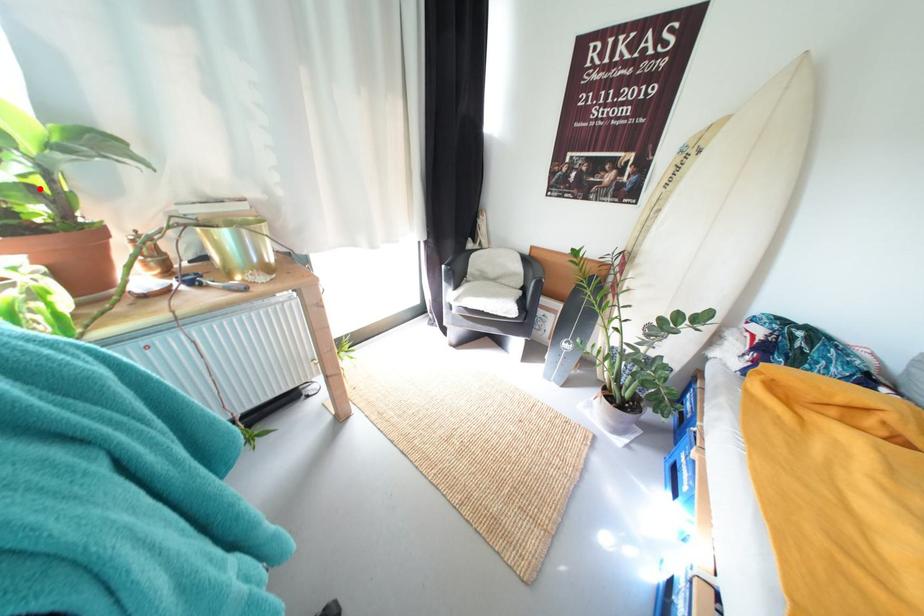
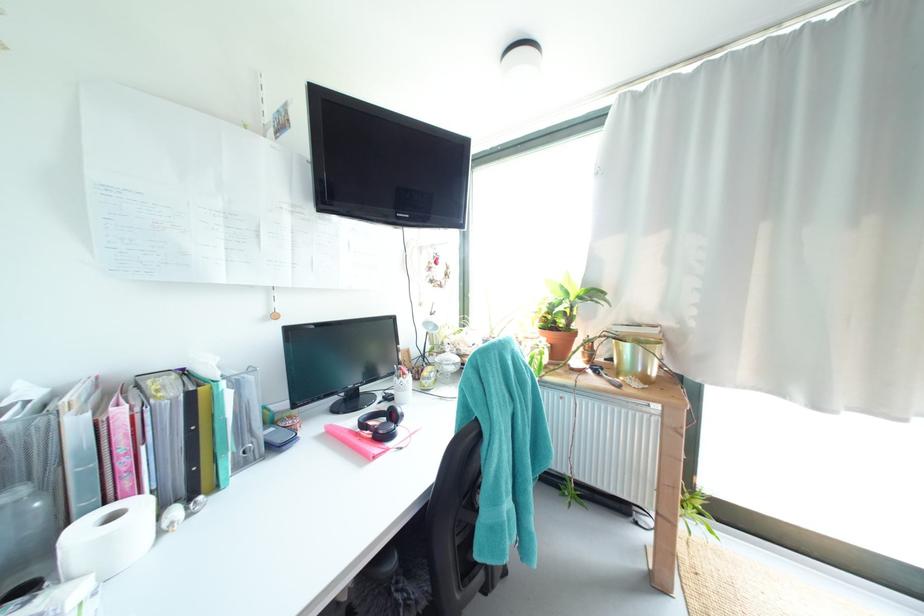
Find the pixel in the second image that matches the highlighted location in the first image.

(573, 315)